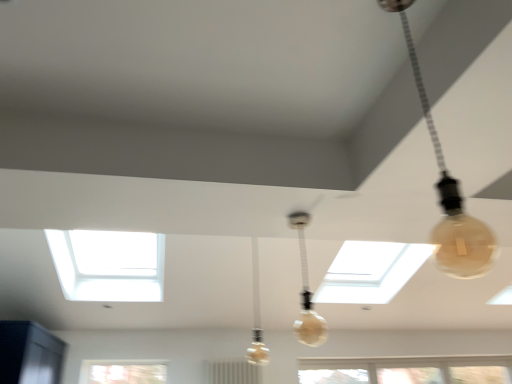
Question: From the image's perspective, is translucent glass bulb at center, placed as the 1th lamp when sorted from back to front, over translucent glass bulb at upper right, which is the first lamp from top to bottom?

Choices:
 (A) yes
 (B) no

Answer: (B)

Question: From a real-world perspective, is translucent glass bulb at center, which is the 3th lamp from right to left, on translucent glass bulb at upper right, which is the first lamp from top to bottom?

Choices:
 (A) yes
 (B) no

Answer: (A)

Question: Is translucent glass bulb at center, placed as the 1th lamp when sorted from back to front, positioned before translucent glass bulb at upper right, which is counted as the 3th lamp, starting from the left?

Choices:
 (A) yes
 (B) no

Answer: (B)

Question: Is translucent glass bulb at center, the third lamp viewed from the front, positioned beyond the bounds of translucent glass bulb at upper right, the 1th lamp viewed from the front?

Choices:
 (A) no
 (B) yes

Answer: (B)

Question: Does translucent glass bulb at center, which is counted as the third lamp, starting from the top, lie behind translucent glass bulb at upper right, arranged as the 3th lamp when ordered from the bottom?

Choices:
 (A) no
 (B) yes

Answer: (B)

Question: Is point (311, 324) positioned closer to the camera than point (253, 261)?

Choices:
 (A) closer
 (B) farther

Answer: (B)

Question: From the image's perspective, is translucent glass bulb at center, placed as the second lamp when sorted from bottom to top, positioned above or below translucent glass bulb at center, which ranks as the first lamp in left-to-right order?

Choices:
 (A) above
 (B) below

Answer: (A)

Question: Considering the positions of translucent glass bulb at center, acting as the second lamp starting from the right, and translucent glass bulb at center, which is counted as the third lamp, starting from the top, in the image, is translucent glass bulb at center, acting as the second lamp starting from the right, wider or thinner than translucent glass bulb at center, which is counted as the third lamp, starting from the top,?

Choices:
 (A) thin
 (B) wide

Answer: (A)

Question: In the image, is translucent glass bulb at center, acting as the 2th lamp starting from the top, positioned in front of or behind translucent glass bulb at center, which is the 3th lamp from right to left?

Choices:
 (A) behind
 (B) front

Answer: (B)

Question: Considering the positions of point (437, 240) and point (257, 347), is point (437, 240) closer or farther from the camera than point (257, 347)?

Choices:
 (A) closer
 (B) farther

Answer: (A)

Question: From their relative heights in the image, would you say translucent glass bulb at upper right, which is counted as the 3th lamp, starting from the left, is taller or shorter than translucent glass bulb at center, which ranks as the first lamp in left-to-right order?

Choices:
 (A) tall
 (B) short

Answer: (B)

Question: From a real-world perspective, is translucent glass bulb at upper right, the first lamp positioned from the right, physically located above or below translucent glass bulb at center, placed as the 1th lamp when sorted from back to front?

Choices:
 (A) below
 (B) above

Answer: (A)

Question: Considering the positions of translucent glass bulb at upper right, the 1th lamp viewed from the front, and translucent glass bulb at center, placed as the 1th lamp when sorted from back to front, in the image, is translucent glass bulb at upper right, the 1th lamp viewed from the front, bigger or smaller than translucent glass bulb at center, placed as the 1th lamp when sorted from back to front,?

Choices:
 (A) small
 (B) big

Answer: (A)

Question: In the image, is translucent glass bulb at upper right, the first lamp positioned from the right, on the left side or the right side of translucent glass bulb at center, the 2th lamp positioned from the left?

Choices:
 (A) right
 (B) left

Answer: (A)

Question: Looking at the image, does translucent glass bulb at upper right, which is the first lamp from top to bottom, seem bigger or smaller compared to translucent glass bulb at center, acting as the 2th lamp starting from the top?

Choices:
 (A) big
 (B) small

Answer: (A)